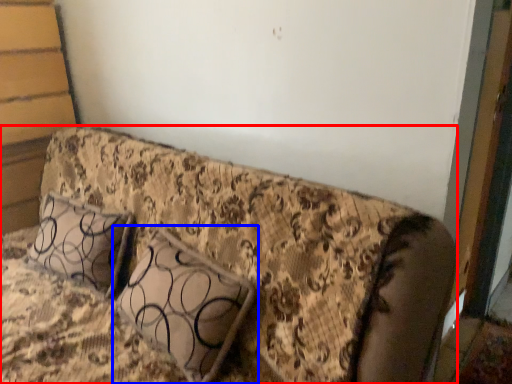
Question: Which point is further to the camera, furniture (highlighted by a red box) or pillow (highlighted by a blue box)?

Choices:
 (A) furniture
 (B) pillow

Answer: (B)